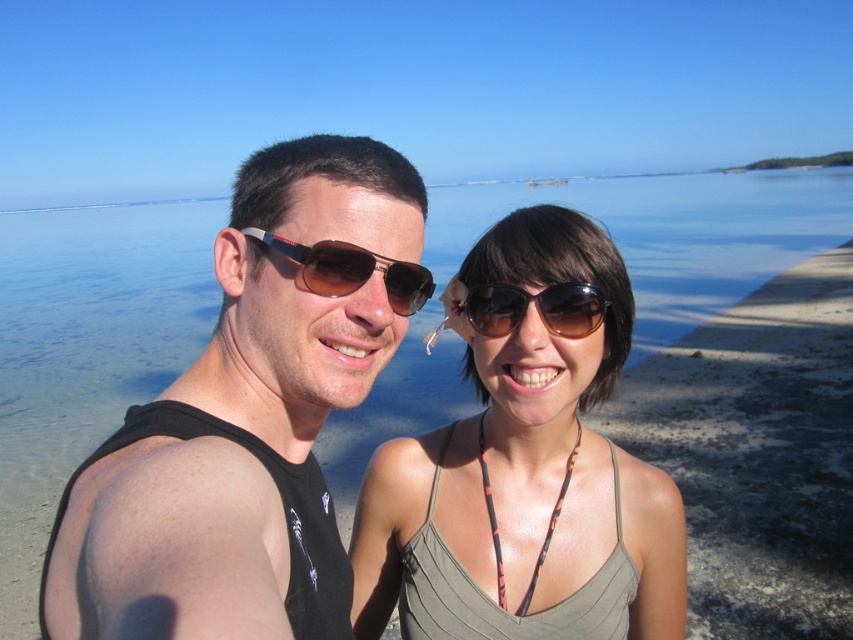
In the scene shown: You are a photographer trying to focus on the matte gray tank top at center and the sunglasses at center in the beach photo. Which object should you adjust your camera focus on first if you want to capture both clearly?

The matte gray tank top at center is closer to the viewer than the sunglasses at center, so you should focus on the matte gray tank tank top at center first to ensure both are in focus.

Based on the photo, you are standing at the beach and want to place a small flag exactly at the point marked as point (335, 280). Since you are 5 feet 6 inches tall, can you reach that point without moving your feet?

The point (335, 280) is 34.99 inches away from the viewer. Since you are 5 feet 6 inches tall, which is 66 inches, you can reach that point without moving your feet as your height allows you to reach beyond 34.99 inches.

You are standing at the beach and want to reach the point marked as point [317,387]. If your stride length is 2.5 feet, how many steps would it take you to reach that point?

The distance to point [317,387] is 35.74 inches. Converting inches to feet, 35.74 inches is approximately 2.98 feet. Dividing by your stride length of 2.5 feet per step gives roughly 1.19 steps. Since you can only take whole steps, you would need 2 steps to reach the point.